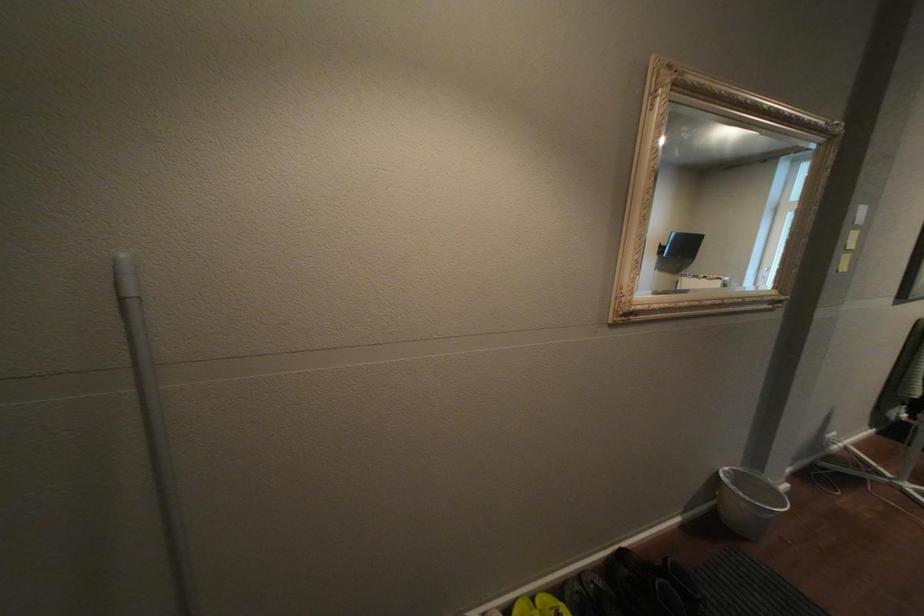
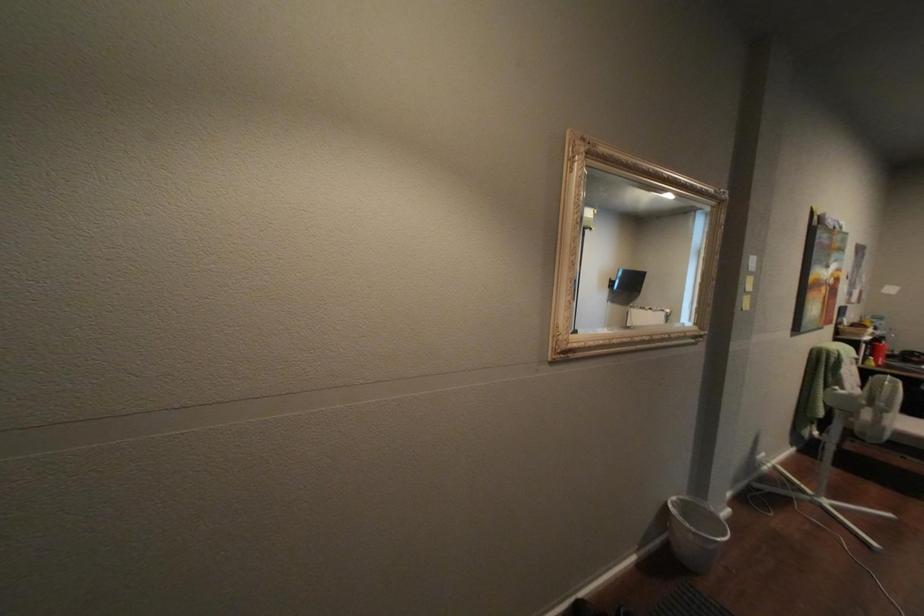
Question: Which direction would the cameraman need to move to produce the second image? Reply with the corresponding letter.

Choices:
 (A) Left
 (B) Right
 (C) Forward
 (D) Backward

Answer: (B)